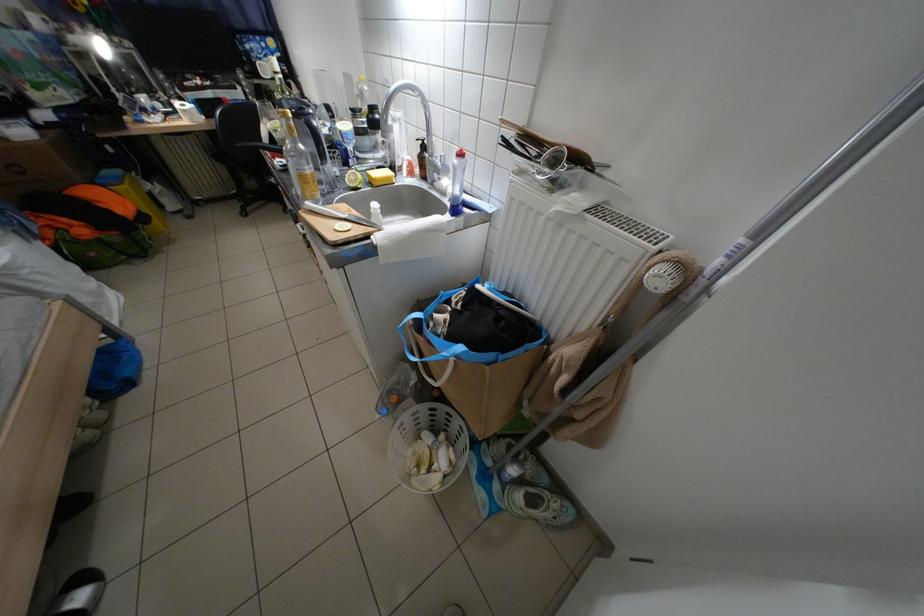
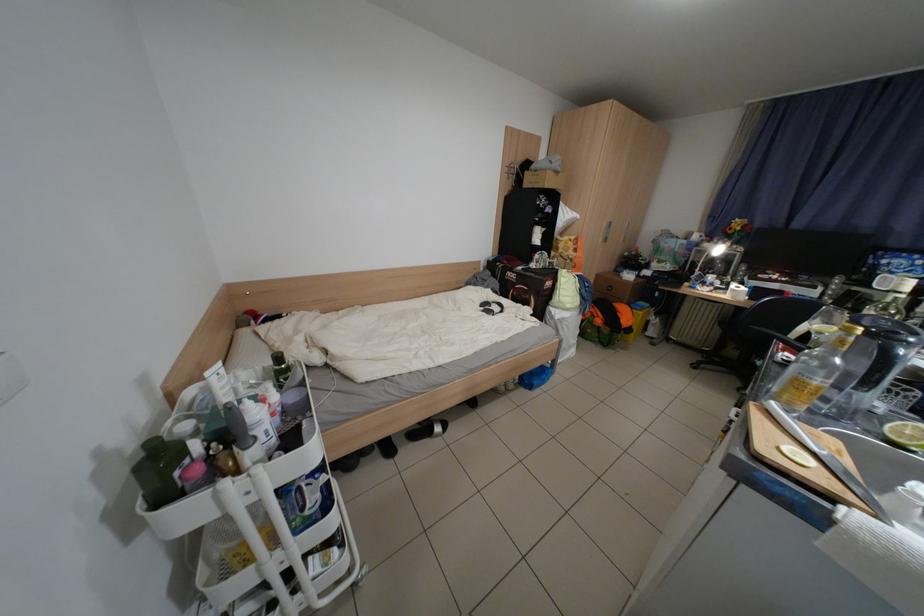
In the second image, find the point that corresponds to [221,135] in the first image.

(748, 310)